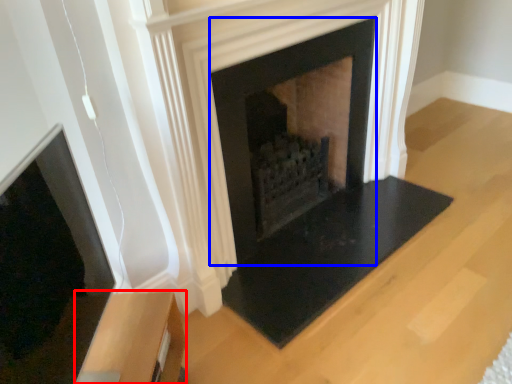
Question: Which object is further to the camera taking this photo, furniture (highlighted by a red box) or fireplace (highlighted by a blue box)?

Choices:
 (A) furniture
 (B) fireplace

Answer: (B)